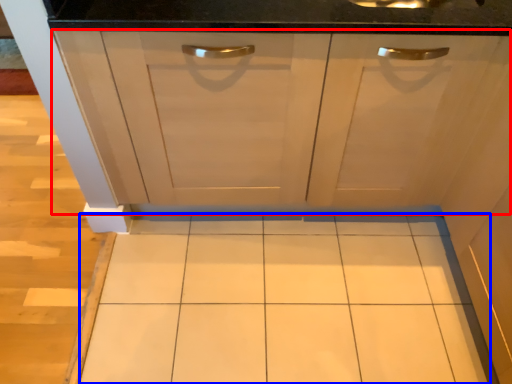
Question: Which point is further to the camera, cabinetry (highlighted by a red box) or ceramic tile (highlighted by a blue box)?

Choices:
 (A) cabinetry
 (B) ceramic tile

Answer: (B)